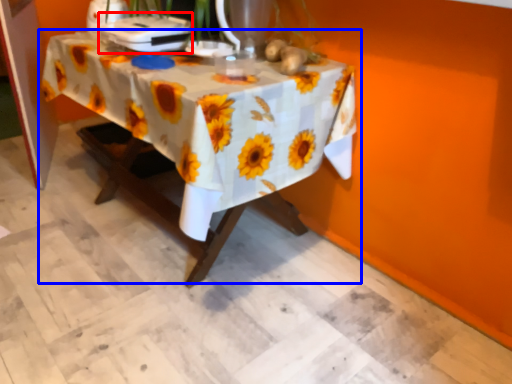
Question: Which of the following is the farthest to the observer, appliance (highlighted by a red box) or table (highlighted by a blue box)?

Choices:
 (A) appliance
 (B) table

Answer: (A)